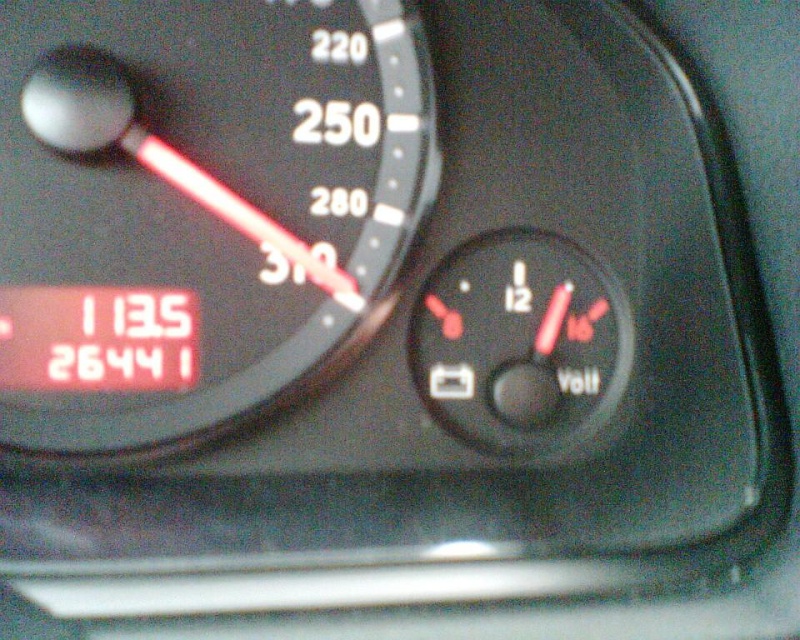
Is black plastic speedometer at upper left below black plastic voltmeter at center?

No, black plastic speedometer at upper left is not below black plastic voltmeter at center.

Does black plastic speedometer at upper left have a larger size compared to black plastic voltmeter at center?

Yes.

Is point (320, 10) less distant than point (433, 340)?

Yes.

Find the location of `black plastic speedometer at upper left`. black plastic speedometer at upper left is located at coordinates (197, 209).